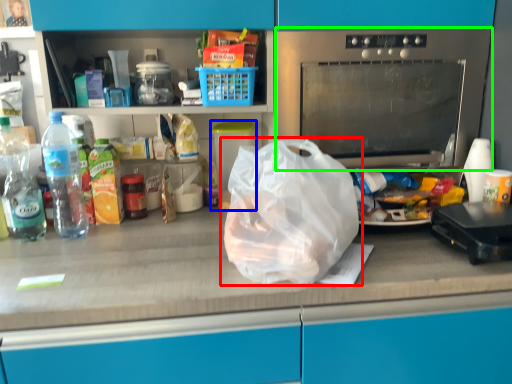
Question: Estimate the real-world distances between objects in this image. Which object is farther from plastic bag (highlighted by a red box), appliance (highlighted by a blue box) or home appliance (highlighted by a green box)?

Choices:
 (A) appliance
 (B) home appliance

Answer: (A)